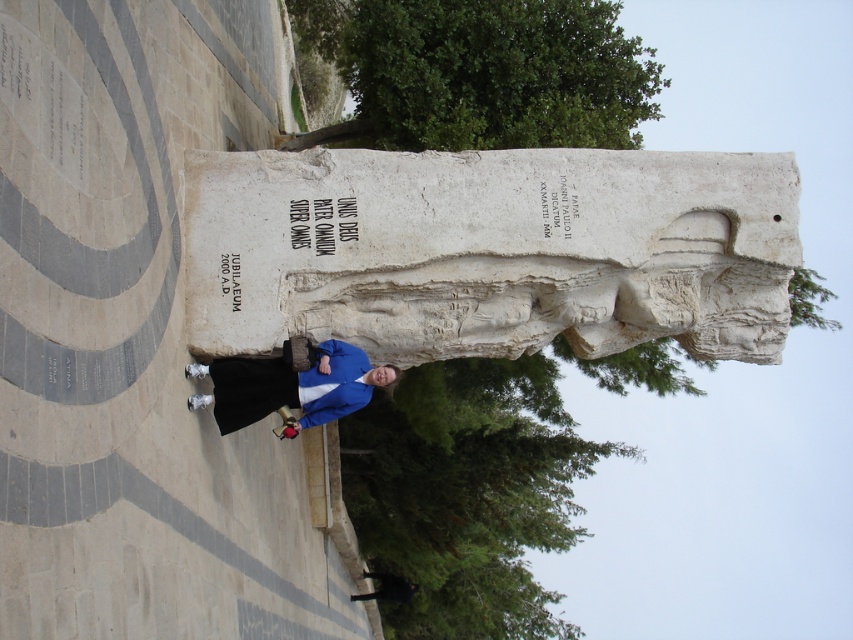
Question: Which of the following is the farthest from the observer?

Choices:
 (A) (224, 250)
 (B) (358, 384)

Answer: (B)

Question: Among these objects, which one is nearest to the camera?

Choices:
 (A) white stone statue at center
 (B) white stone sculpture at center

Answer: (B)

Question: Does white stone sculpture at center have a larger size compared to black fabric jacket at lower center?

Choices:
 (A) yes
 (B) no

Answer: (A)

Question: Considering the relative positions of white stone sculpture at center and black fabric jacket at lower center in the image provided, where is white stone sculpture at center located with respect to black fabric jacket at lower center?

Choices:
 (A) left
 (B) right

Answer: (A)

Question: Which of these objects is positioned closest to the black fabric jacket at lower center?

Choices:
 (A) white stone sculpture at center
 (B) white stone statue at center

Answer: (B)

Question: Does white stone statue at center have a larger size compared to black fabric jacket at lower center?

Choices:
 (A) yes
 (B) no

Answer: (A)